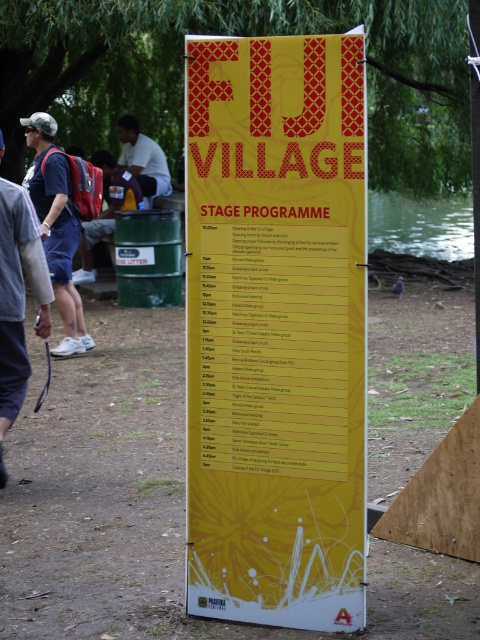
Who is lower down, matte blue shorts at left or matte blue shirt at left?

matte blue shorts at left

Is matte blue shorts at left wider than matte blue shirt at left?

No.

The height and width of the screenshot is (640, 480). What are the coordinates of `matte blue shorts at left` in the screenshot? It's located at (17, 300).

Is point (331, 285) positioned behind point (12, 260)?

That is False.

Between point (237, 134) and point (13, 284), which one is positioned in front?

Point (237, 134)

This screenshot has height=640, width=480. In order to click on yellow paper poster at center in this screenshot , I will do `click(276, 328)`.

I want to click on yellow paper poster at center, so click(276, 328).

Does matte blue shirt at left have a larger size compared to white matte shirt at upper center?

Yes, matte blue shirt at left is bigger than white matte shirt at upper center.

Which is more to the right, matte blue shirt at left or white matte shirt at upper center?

From the viewer's perspective, white matte shirt at upper center appears more on the right side.

This screenshot has width=480, height=640. Identify the location of matte blue shirt at left. (56, 227).

What are the coordinates of `matte blue shirt at left` in the screenshot? It's located at (56, 227).